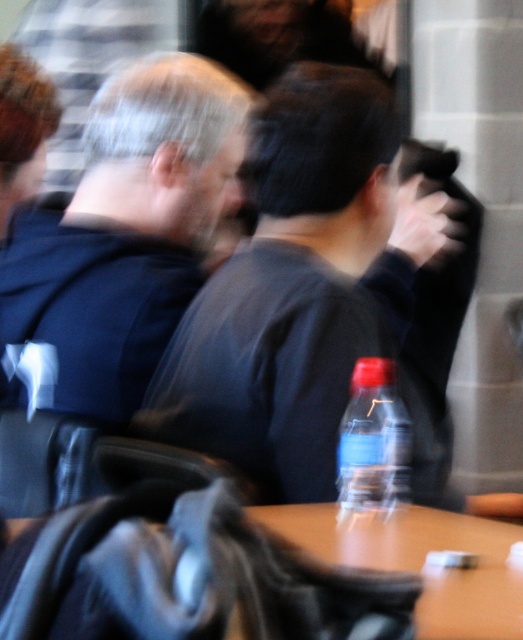
Does point (461, 598) come behind point (395, 500)?

That is False.

Identify the location of wooden table at center. pyautogui.click(x=418, y=561).

Is dark gray sweater at center taller than translucent plastic bottle at center?

Yes, dark gray sweater at center is taller than translucent plastic bottle at center.

Image resolution: width=523 pixels, height=640 pixels. Describe the element at coordinates (293, 291) in the screenshot. I see `dark gray sweater at center` at that location.

Locate an element on the screen. dark gray sweater at center is located at coordinates (293, 291).

Locate an element on the screen. The height and width of the screenshot is (640, 523). dark gray sweater at center is located at coordinates (293, 291).

Is dark blue fabric at left positioned before wooden table at center?

No, it is behind wooden table at center.

Which is in front, point (152, 77) or point (291, 531)?

Point (291, 531) is more forward.

Does point (221, 100) come in front of point (405, 545)?

No, it is behind (405, 545).

Find the location of a particular element. This screenshot has width=523, height=640. dark blue fabric at left is located at coordinates (122, 240).